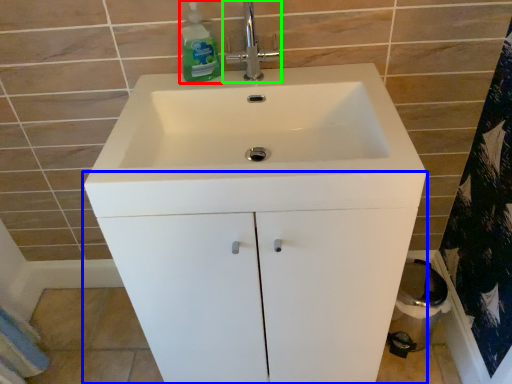
Question: Which object is the farthest from cleaning product (highlighted by a red box)? Choose among these: bathroom cabinet (highlighted by a blue box) or tap (highlighted by a green box).

Choices:
 (A) bathroom cabinet
 (B) tap

Answer: (A)